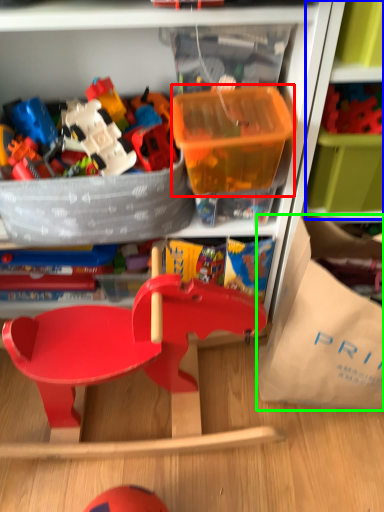
Question: Which object is positioned closest to storage box (highlighted by a red box)? Select from shelf (highlighted by a blue box) and paper bag (highlighted by a green box).

Choices:
 (A) shelf
 (B) paper bag

Answer: (A)